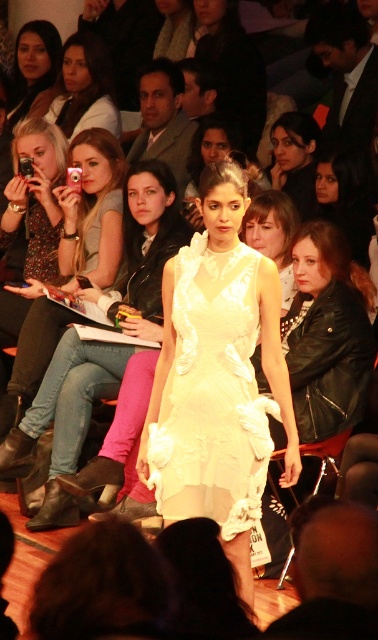
You are standing at the entrance of the runway and see the point marked as point (35, 196). Is there a camera located at that point?

Yes, the point (35, 196) corresponds to a matte black camera at left, so there is a camera located at that point.

You are a photographer at the fashion show and you want to take a photo of the model wearing the white dress. You have a matte black leather jacket at upper center and a matte black camera at upper left. Which object is taller so that it might block your view of the model?

The matte black leather jacket at upper center is taller than the matte black camera at upper left, so it might block your view of the model.

You are a photographer at a fashion show. You have a matte black camera at left. Where is your camera located in the coordinate system of the runway? Please provide coordinates in the format of a point like this example format of point coordinates in the system of the runway.

The matte black camera at left is located at point coordinates of (35,196) in the runway system.